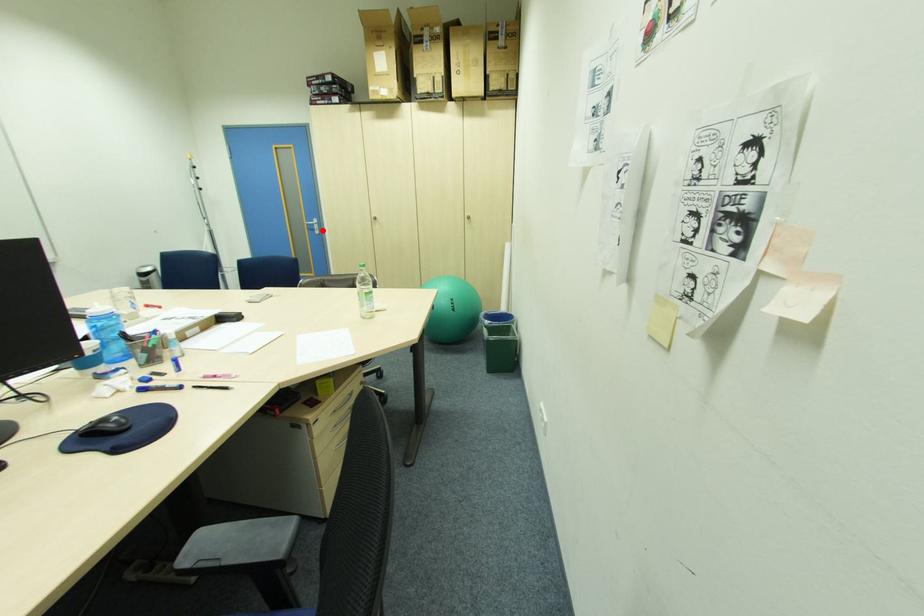
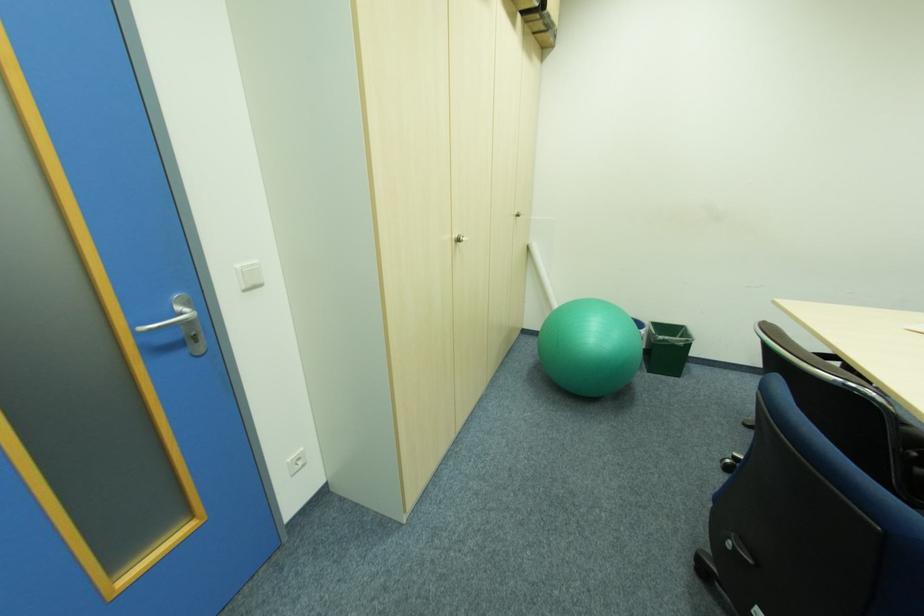
Locate, in the second image, the point that corresponds to the highlighted location in the first image.

(200, 339)